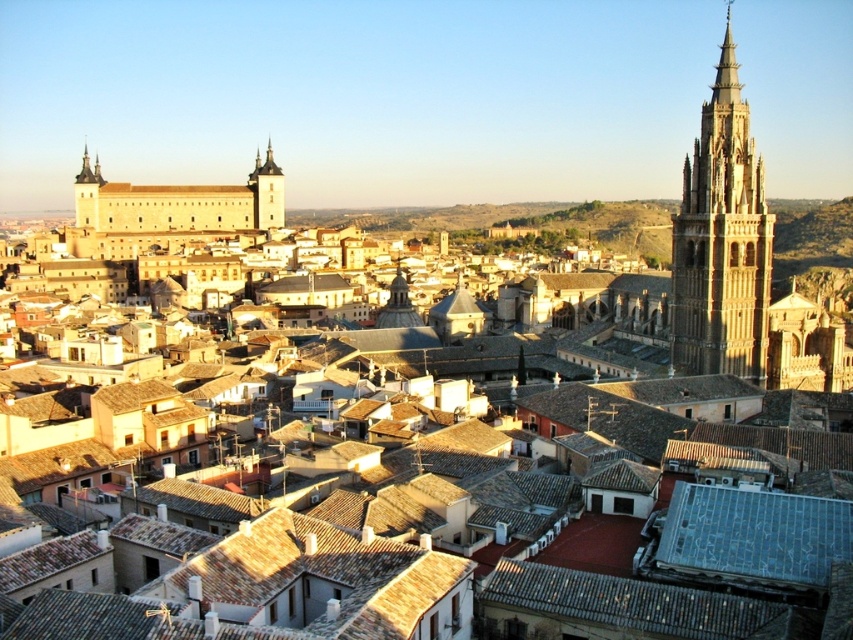
Question: Which object is farther from the camera taking this photo?

Choices:
 (A) stone gothic tower at right
 (B) light brown stone tower at center-left

Answer: (B)

Question: Is stone gothic tower at right wider than light brown stone tower at center-left?

Choices:
 (A) no
 (B) yes

Answer: (A)

Question: Can you confirm if stone gothic tower at right is positioned above light brown stone tower at center-left?

Choices:
 (A) no
 (B) yes

Answer: (A)

Question: In this image, where is stone gothic tower at right located relative to light brown stone tower at center-left?

Choices:
 (A) left
 (B) right

Answer: (B)

Question: Which point is closer to the camera?

Choices:
 (A) stone gothic tower at right
 (B) light brown stone tower at center-left

Answer: (A)